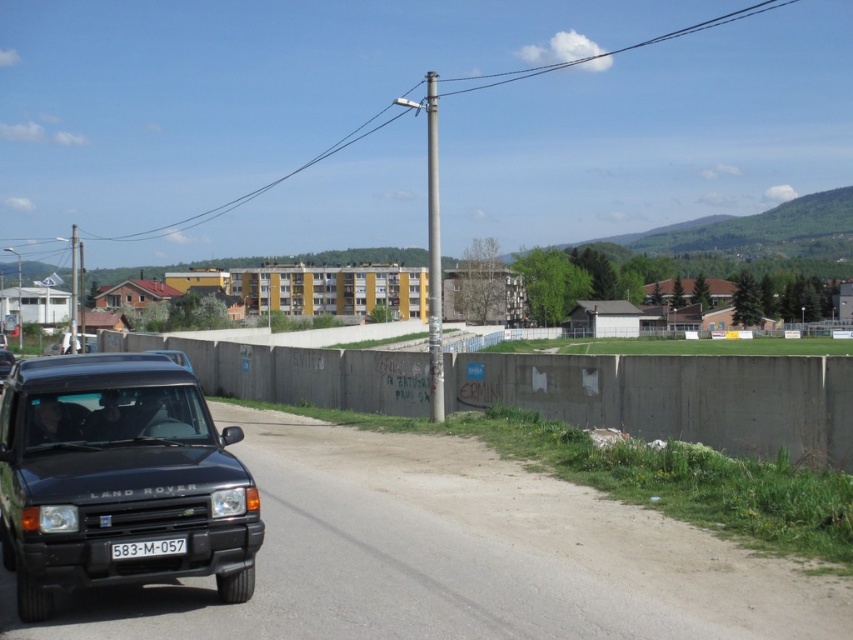
You are standing at the intersection of the road and want to take a photo of the black matte suv at lower left and the concrete wall at center. If your camera can focus on objects up to 60 feet away, will both objects be in focus?

The black matte suv at lower left is 55.75 feet away from the concrete wall at center. Since the camera can focus up to 60 feet, both objects will be within the focus range and thus in focus.

What is the spatial relationship between the black matte suv at lower left and the white plastic license plate at lower center?

The black matte suv at lower left is above the white plastic license plate at lower center.